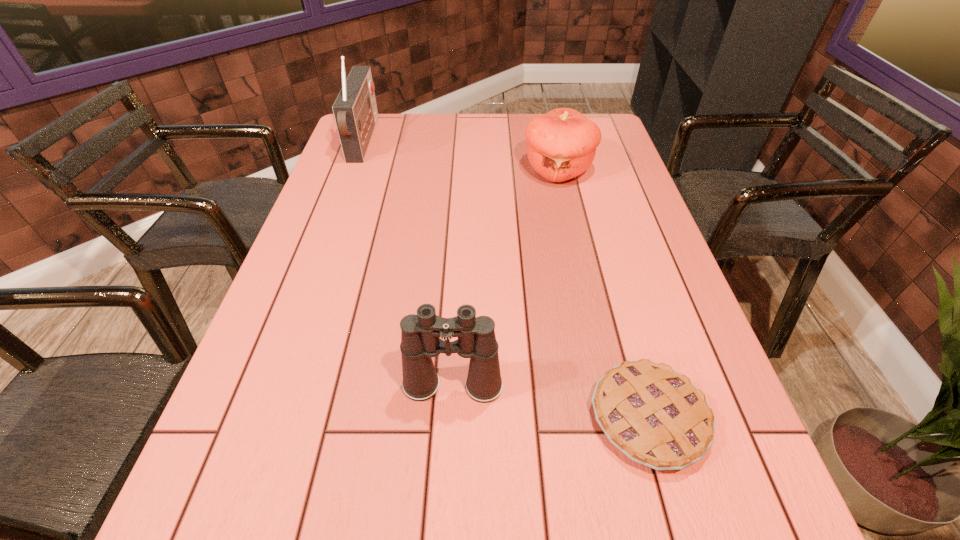
The image size is (960, 540). I want to click on vacant space that satisfies the following two spatial constraints: 1. on the front panel of the tallest object; 2. on the back side of the pumpkin, so click(x=353, y=171).

Locate an element on the screen. The image size is (960, 540). vacant space that satisfies the following two spatial constraints: 1. on the front panel of the leftmost object; 2. on the right side of the shortest object is located at coordinates (264, 418).